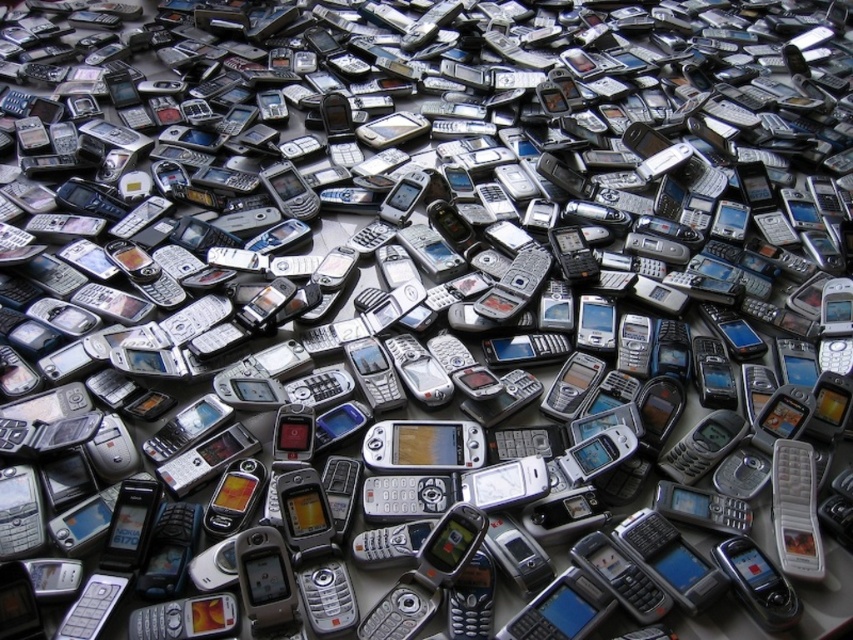
Can you confirm if wooden phone at center is thinner than silver metallic phone at center?

In fact, wooden phone at center might be wider than silver metallic phone at center.

How distant is wooden phone at center from silver metallic phone at center?

wooden phone at center is 22.93 inches away from silver metallic phone at center.

I want to click on wooden phone at center, so click(422, 445).